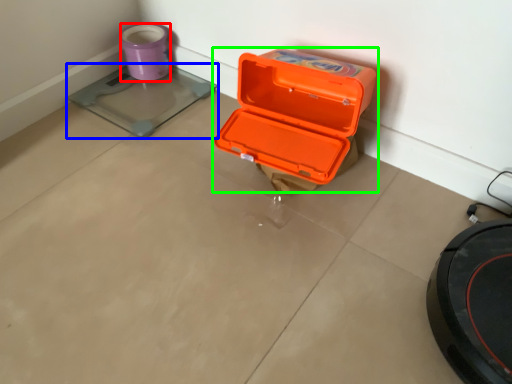
Question: Which object is positioned closest to appliance (highlighted by a red box)? Select from weight scale (highlighted by a blue box) and box (highlighted by a green box).

Choices:
 (A) weight scale
 (B) box

Answer: (A)